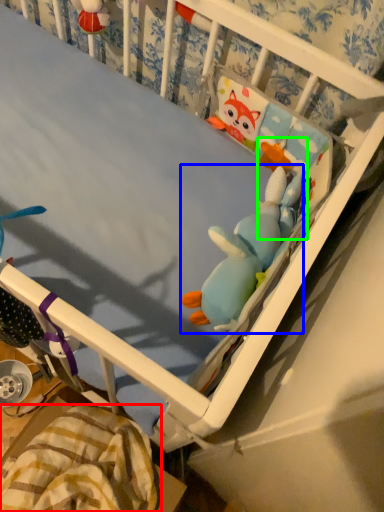
Question: Which object is the closest to the blanket (highlighted by a red box)? Choose among these: toy (highlighted by a blue box) or toy (highlighted by a green box).

Choices:
 (A) toy
 (B) toy

Answer: (A)